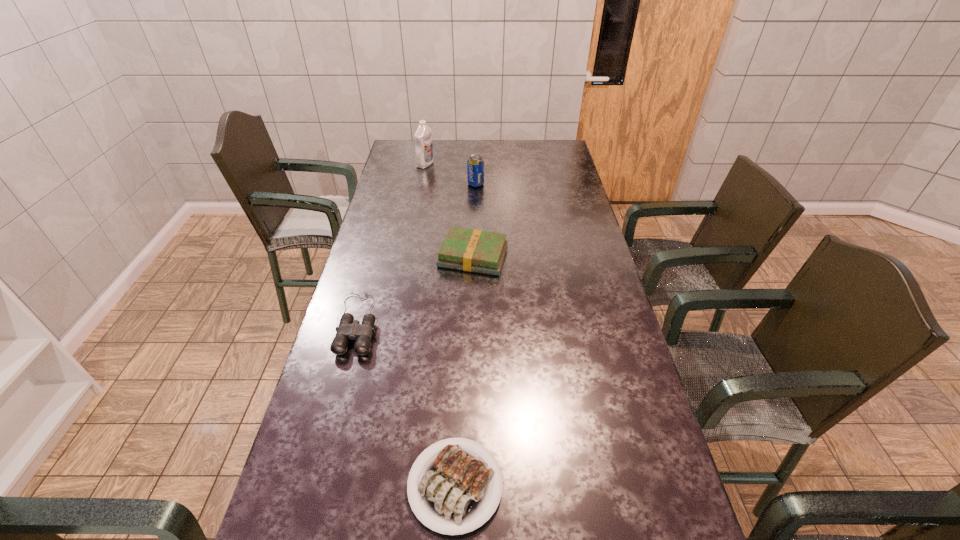
Locate an element on the screen. This screenshot has height=540, width=960. free space located on the front of the third shortest object is located at coordinates (471, 345).

Where is `free region located 0.190m at the eyepiece of the leftmost object`? The image size is (960, 540). free region located 0.190m at the eyepiece of the leftmost object is located at coordinates (331, 418).

Find the location of a particular element. The image size is (960, 540). object present at the far edge is located at coordinates (424, 156).

I want to click on detergent that is at the left edge, so click(x=424, y=156).

Locate an element on the screen. The image size is (960, 540). binoculars that is at the left edge is located at coordinates (349, 329).

Image resolution: width=960 pixels, height=540 pixels. What are the coordinates of `object positioned at the far left corner` in the screenshot? It's located at (424, 156).

In the image, there is a desktop. What are the coordinates of `vacant space at the left edge` in the screenshot? It's located at (381, 191).

At what (x,y) coordinates should I click in order to perform the action: click on vacant space at the right edge. Please return your answer as a coordinate pair (x, y). Looking at the image, I should click on (587, 249).

At what (x,y) coordinates should I click in order to perform the action: click on vacant space at the far left corner. Please return your answer as a coordinate pair (x, y). The image size is (960, 540). Looking at the image, I should click on (413, 163).

This screenshot has width=960, height=540. In the image, there is a desktop. Identify the location of vacant area at the far right corner. (559, 148).